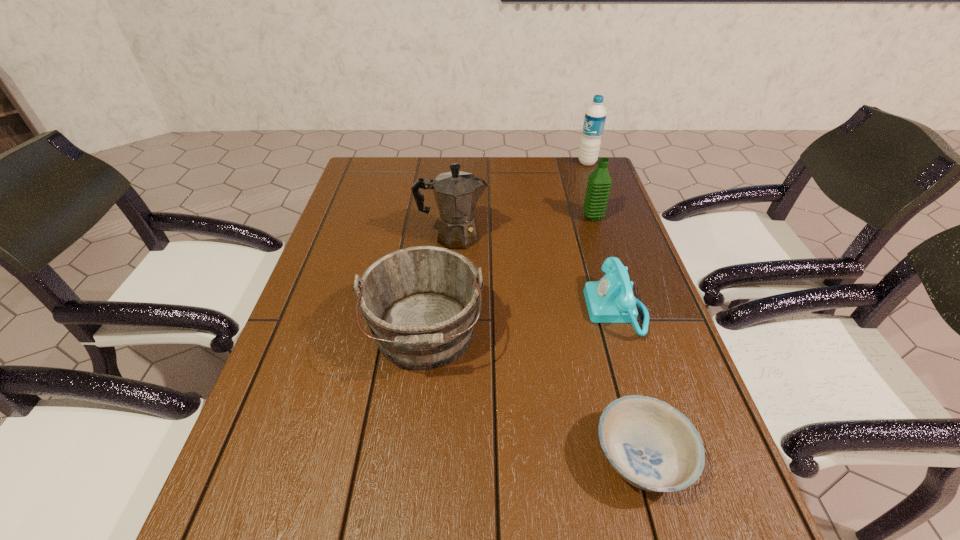
The width and height of the screenshot is (960, 540). I want to click on telephone present at the right edge, so click(610, 300).

Find the location of a particular element. This screenshot has height=540, width=960. bowl positioned at the right edge is located at coordinates (651, 445).

Where is `object that is at the far right corner`? This screenshot has height=540, width=960. object that is at the far right corner is located at coordinates (595, 115).

Where is `vacant space at the far edge`? The width and height of the screenshot is (960, 540). vacant space at the far edge is located at coordinates (542, 158).

At what (x,y) coordinates should I click in order to perform the action: click on free space at the left edge of the desktop. Please return your answer as a coordinate pair (x, y). Looking at the image, I should click on (368, 242).

The height and width of the screenshot is (540, 960). What are the coordinates of `blank space at the right edge of the desktop` in the screenshot? It's located at (627, 234).

At what (x,y) coordinates should I click in order to perform the action: click on vacant space at the far left corner of the desktop. Please return your answer as a coordinate pair (x, y). Looking at the image, I should click on (400, 160).

At what (x,y) coordinates should I click in order to perform the action: click on free spot between the second farthest object and the shortest object. Please return your answer as a coordinate pair (x, y). The width and height of the screenshot is (960, 540). Looking at the image, I should click on (617, 338).

This screenshot has height=540, width=960. What are the coordinates of `vacant area between the fourth nearest object and the taller water bottle` in the screenshot? It's located at (520, 199).

You are a GUI agent. You are given a task and a screenshot of the screen. Output one action in this format:
    pyautogui.click(x=<x>, y=<y>)
    Task: Click on the vacant area that lies between the bowl and the third farthest object
    This screenshot has width=960, height=540.
    Given the screenshot: What is the action you would take?
    pyautogui.click(x=547, y=347)